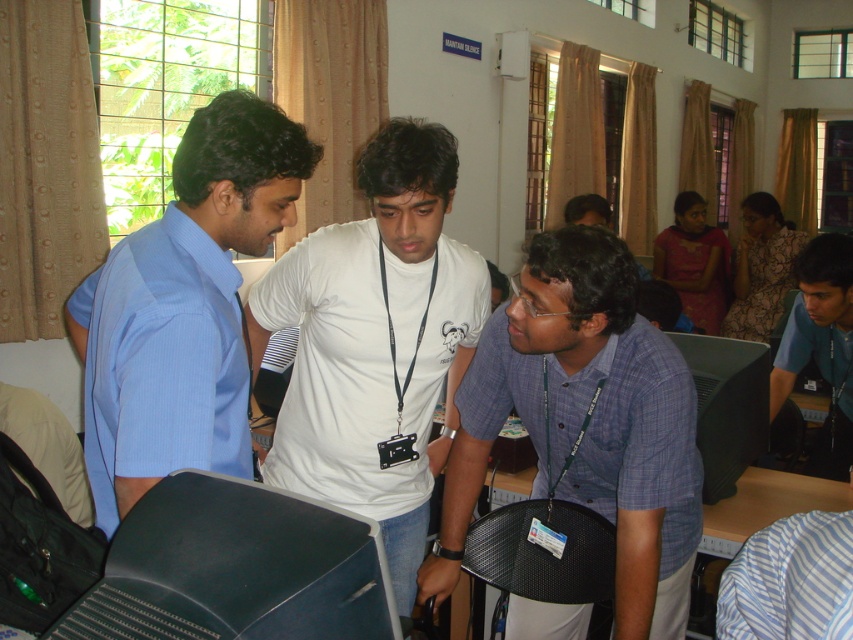
Which is more to the left, blue plaid shirt at center or matte pink saree at upper right?

blue plaid shirt at center

Is blue plaid shirt at center thinner than matte pink saree at upper right?

Incorrect, blue plaid shirt at center's width is not less than matte pink saree at upper right's.

Is point (547, 232) positioned in front of point (718, 301)?

That is True.

This screenshot has width=853, height=640. In order to click on blue plaid shirt at center in this screenshot , I will do `click(585, 422)`.

From the picture: Can you confirm if light blue shirt at left is positioned to the right of matte black monitor at center?

In fact, light blue shirt at left is to the left of matte black monitor at center.

Which of these two, light blue shirt at left or matte black monitor at center, stands shorter?

matte black monitor at center

This screenshot has height=640, width=853. Describe the element at coordinates (184, 307) in the screenshot. I see `light blue shirt at left` at that location.

Locate an element on the screen. The height and width of the screenshot is (640, 853). light blue shirt at left is located at coordinates (184, 307).

Does point (137, 298) lie behind point (711, 362)?

No, (137, 298) is in front of (711, 362).

Between point (103, 516) and point (740, 472), which one is positioned behind?

The point (740, 472) is more distant.

Does point (254, 177) lie behind point (714, 412)?

No, (254, 177) is in front of (714, 412).

The height and width of the screenshot is (640, 853). In order to click on light blue shirt at left in this screenshot , I will do `click(184, 307)`.